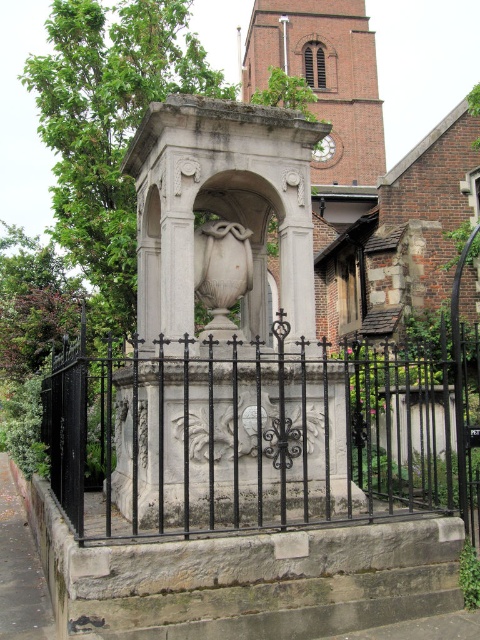
You are standing in front of the stone monument enclosed by a black wrought iron fence. You notice two points marked on the monument. The first point is at coordinates point (467, 451) and the second is at point (241, 289). Which of these two points is closer to you?

Point (467, 451) is closer to the viewer than point (241, 289).

Looking at this image, you are an artist planning to sketch the monument. You notice two central objects, the white stone urn at center and the white marble vase at center. Which one should you draw first if you want to start with the narrower object?

The white stone urn at center is narrower than the white marble vase at center, so you should draw the white stone urn at center first.

You are standing in front of the monument and notice the black wrought iron fence at center and the white marble vase at center. Which object is positioned to the left of the other?

The white marble vase at center is to the left of the black wrought iron fence at center.